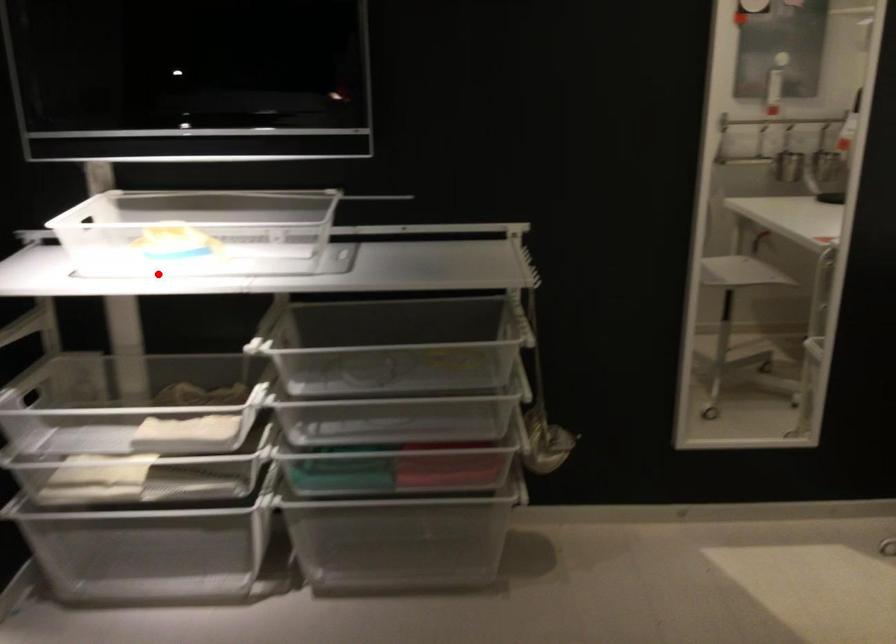
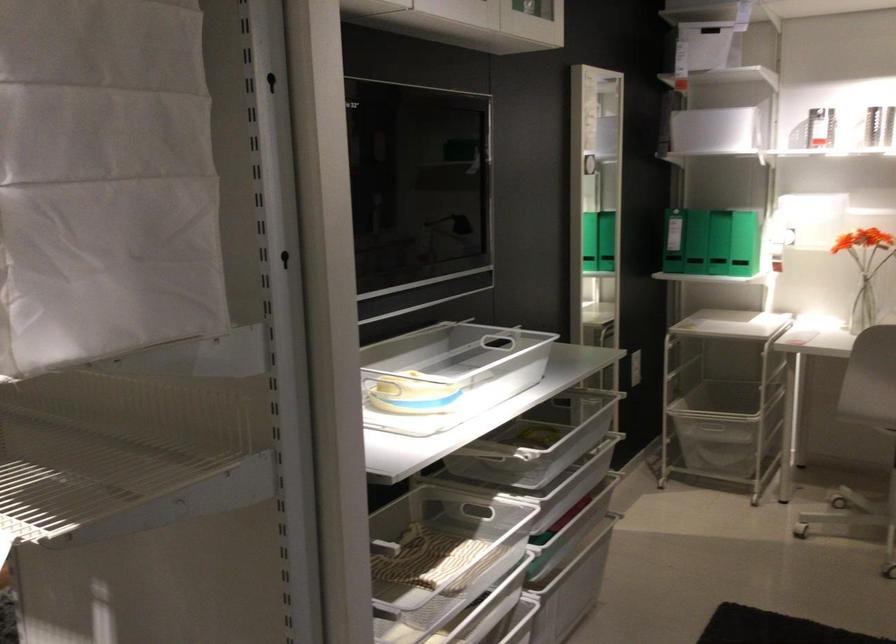
Question: I am providing you with two images of the same scene from different viewpoints. A red point is marked on the first image. At the location where the point appears in image 1, is it still visible in image 2?

Choices:
 (A) Yes
 (B) No

Answer: (A)